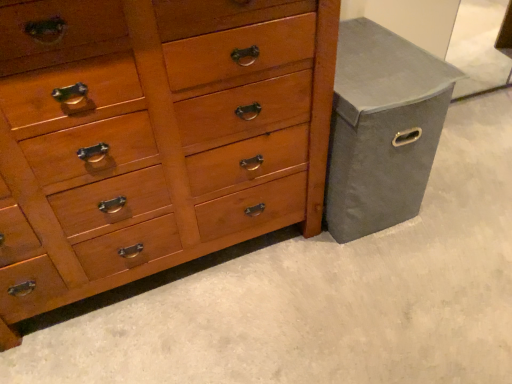
Question: From their relative heights in the image, would you say matte gray fabric bin at right is taller or shorter than shiny wood chest of drawers at center?

Choices:
 (A) short
 (B) tall

Answer: (A)

Question: Do you think matte gray fabric bin at right is within shiny wood chest of drawers at center, or outside of it?

Choices:
 (A) outside
 (B) inside

Answer: (A)

Question: In terms of size, does matte gray fabric bin at right appear bigger or smaller than shiny wood chest of drawers at center?

Choices:
 (A) small
 (B) big

Answer: (A)

Question: From their relative heights in the image, would you say shiny wood chest of drawers at center is taller or shorter than matte gray fabric bin at right?

Choices:
 (A) short
 (B) tall

Answer: (B)

Question: Considering the positions of shiny wood chest of drawers at center and matte gray fabric bin at right in the image, is shiny wood chest of drawers at center wider or thinner than matte gray fabric bin at right?

Choices:
 (A) thin
 (B) wide

Answer: (A)

Question: In the image, is shiny wood chest of drawers at center on the left side or the right side of matte gray fabric bin at right?

Choices:
 (A) left
 (B) right

Answer: (A)

Question: Is shiny wood chest of drawers at center in front of or behind matte gray fabric bin at right in the image?

Choices:
 (A) behind
 (B) front

Answer: (B)